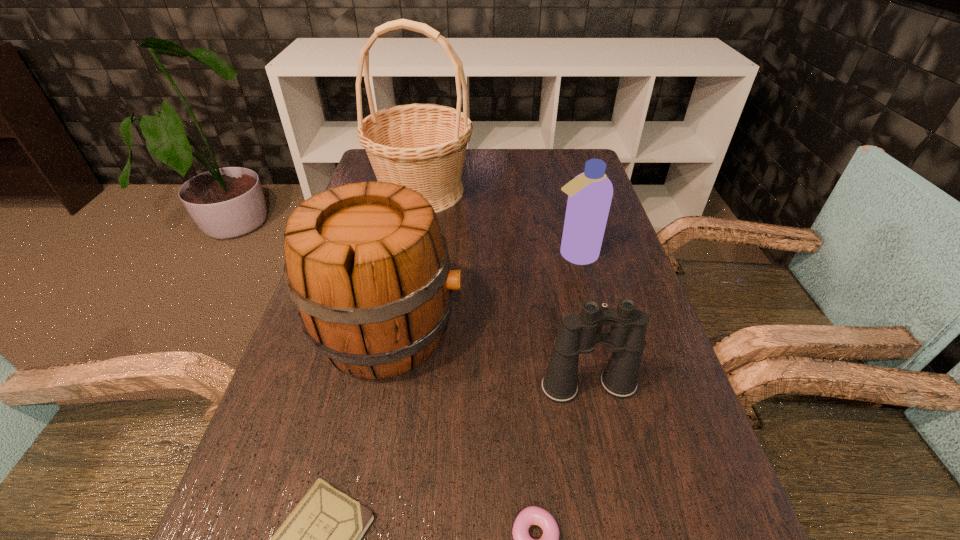
This screenshot has height=540, width=960. Identify the location of vacant space that is in between the farthest object and the third shortest object. (505, 289).

Identify the location of vacant area between the third shortest object and the cider. The width and height of the screenshot is (960, 540). (489, 359).

Image resolution: width=960 pixels, height=540 pixels. Find the location of `the closest object to the second shortest object`. the closest object to the second shortest object is located at coordinates (578, 335).

Locate an element on the screen. the second closest object relative to the cider is located at coordinates (321, 539).

I want to click on free space that satisfies the following two spatial constraints: 1. on the side of the cider where the spigot is located; 2. on the right side of the third shortest object, so click(376, 386).